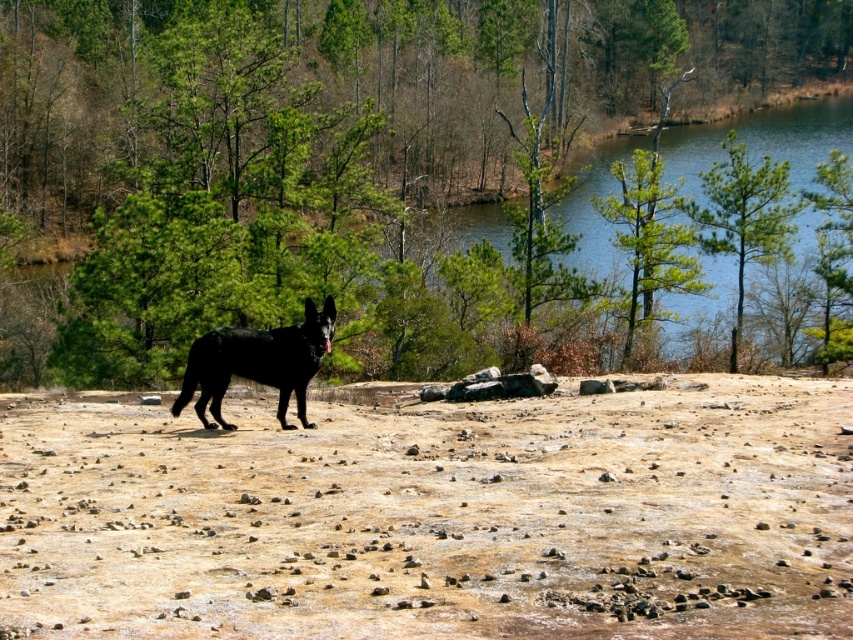
You are a photographer standing at the camera position. You want to take a closeup shot of the shiny black dog at center. Considering the distance between you and the dog, would you need to use a telephoto lens to capture the dog clearly?

The shiny black dog at center and camera are 55.49 feet apart. A telephoto lens is ideal for capturing distant subjects clearly, so yes, you would need a telephoto lens to take a closeup shot of the shiny black dog at center from that distance.

You are a hiker trying to cross the rocky terrain. You notice the brown sandy soil at center and the green matte tree at upper right. Which object covers a wider area in the image?

The brown sandy soil at center covers a wider area than the green matte tree at upper right because its width surpasses that of the tree.

You are a photographer trying to capture the shiny black dog at center and the brown sandy soil at center in the same frame. Given that your camera has a maximum focus range of 4 meters, will you be able to focus on both subjects simultaneously?

The brown sandy soil at center and shiny black dog at center are 3.85 meters apart from each other, so yes, the camera can focus on both subjects since the distance between them is within the 4 meters maximum focus range.